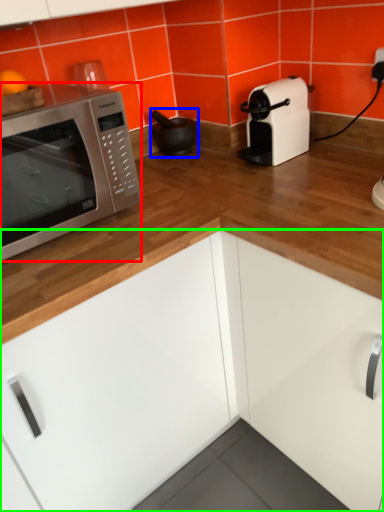
Question: Estimate the real-world distances between objects in this image. Which object is closer to microwave oven (highlighted by a red box), appliance (highlighted by a blue box) or cabinetry (highlighted by a green box)?

Choices:
 (A) appliance
 (B) cabinetry

Answer: (B)